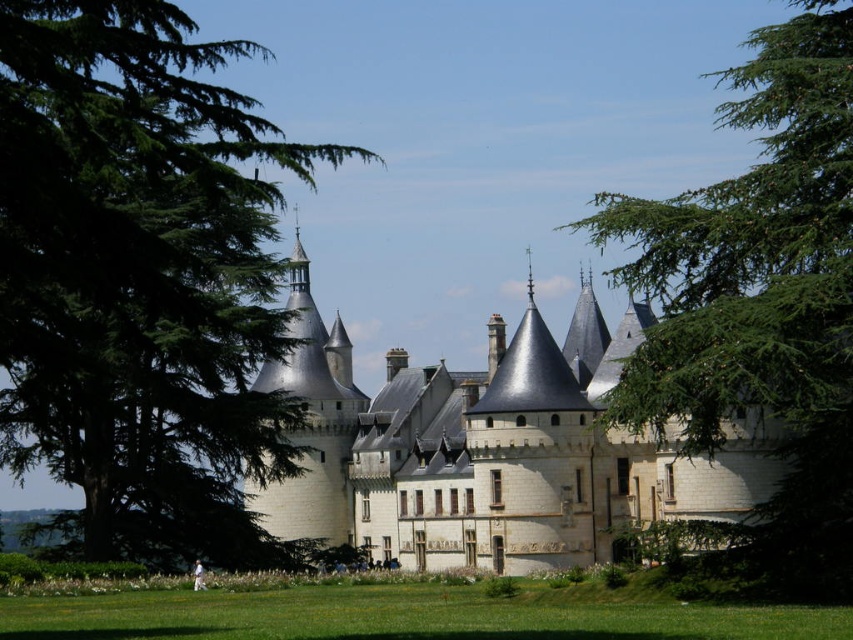
Find the location of a particular element. This screenshot has width=853, height=640. green leafy tree at left is located at coordinates (138, 275).

Between point (225, 340) and point (769, 536), which one is positioned in front?

Point (769, 536) is more forward.

I want to click on green leafy tree at left, so click(138, 275).

Is the position of green textured leaves at center more distant than that of smooth stone castle at center?

No, it is not.

Does green textured leaves at center appear over smooth stone castle at center?

Indeed, green textured leaves at center is positioned over smooth stone castle at center.

Is point (759, 188) positioned in front of point (426, 529)?

Yes, point (759, 188) is closer to viewer.

At what (x,y) coordinates should I click in order to perform the action: click on green textured leaves at center. Please return your answer as a coordinate pair (x, y). This screenshot has height=640, width=853. Looking at the image, I should click on (759, 301).

Is green leafy tree at left bigger than smooth stone castle at center?

Yes, green leafy tree at left is bigger than smooth stone castle at center.

Which is more to the right, green leafy tree at left or smooth stone castle at center?

smooth stone castle at center

Find the location of a particular element. This screenshot has width=853, height=640. green leafy tree at left is located at coordinates (x=138, y=275).

The height and width of the screenshot is (640, 853). Find the location of `green leafy tree at left`. green leafy tree at left is located at coordinates (138, 275).